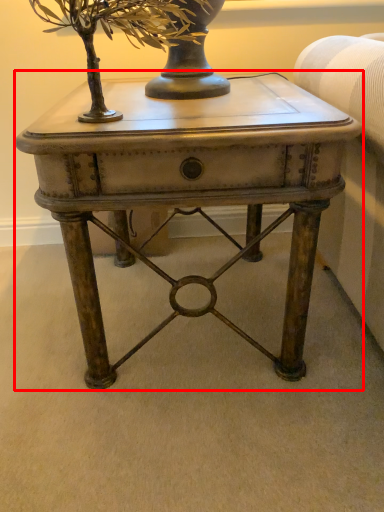
Question: From the image's perspective, what is the correct spatial positioning of table (annotated by the red box) in reference to tree?

Choices:
 (A) above
 (B) below

Answer: (B)